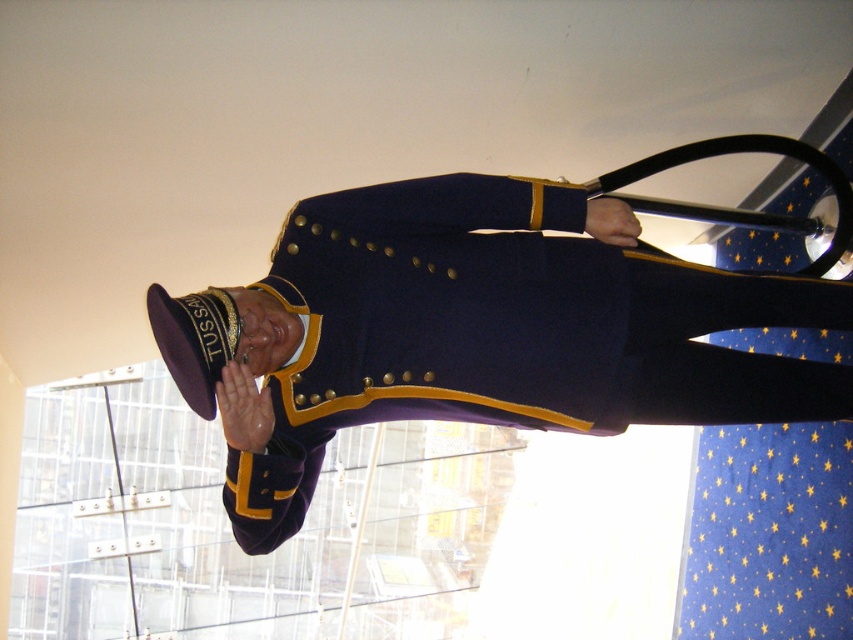
Is navy wool uniform at center below maroon felt hat at center?

Actually, navy wool uniform at center is above maroon felt hat at center.

Who is positioned more to the right, navy wool uniform at center or maroon felt hat at center?

Positioned to the right is navy wool uniform at center.

Is point (335, 250) positioned in front of point (173, 332)?

No, it is behind (173, 332).

Where is `navy wool uniform at center`? This screenshot has height=640, width=853. navy wool uniform at center is located at coordinates (492, 332).